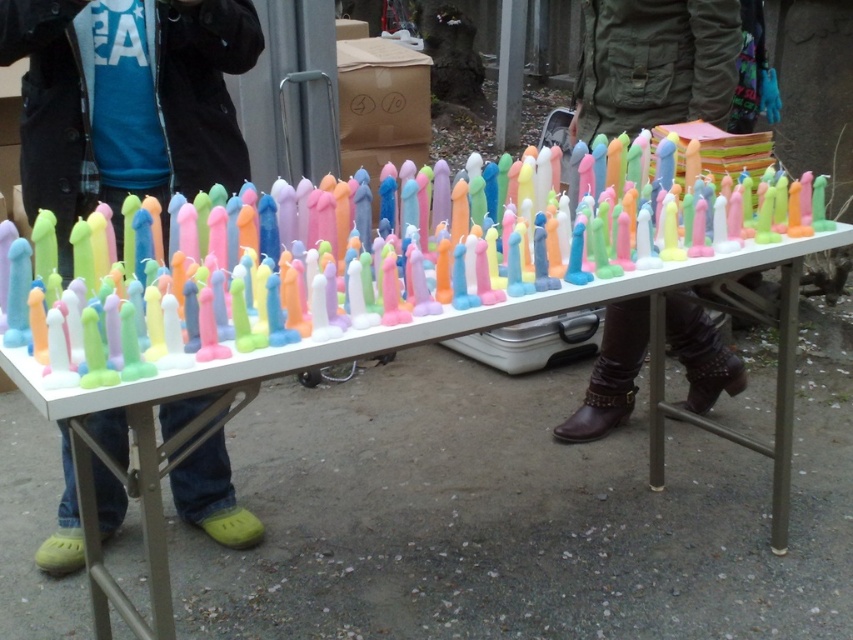
You are standing at the camera position and want to reach the white plastic table at center to pick up a candle. How many steps do you need to take if each step covers 1.5 feet?

The white plastic table at center is 3.90 feet away from the camera. Since each step covers 1.5 feet, you would need to take approximately 3 steps to reach it. The calculation is 3.90 divided by 1.5, which equals 2.6, so rounding up to the nearest whole number gives 3 steps.

You are setting up for an event and need to place a large decorative item on the table. Given the white plastic table at center and the brown leather boots at lower center, which object can accommodate the item based on their sizes?

The white plastic table at center is larger in size than the brown leather boots at lower center, so the table can accommodate the large decorative item.